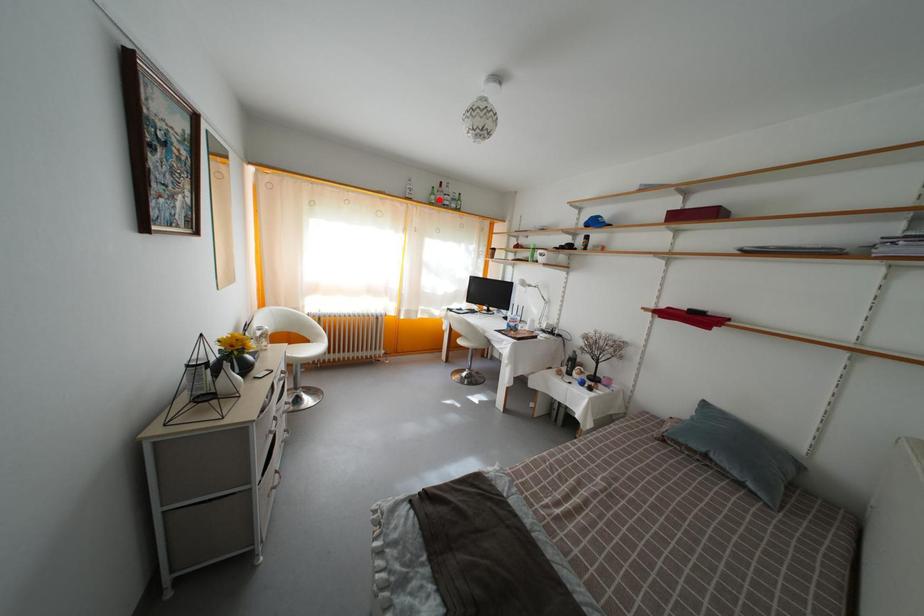
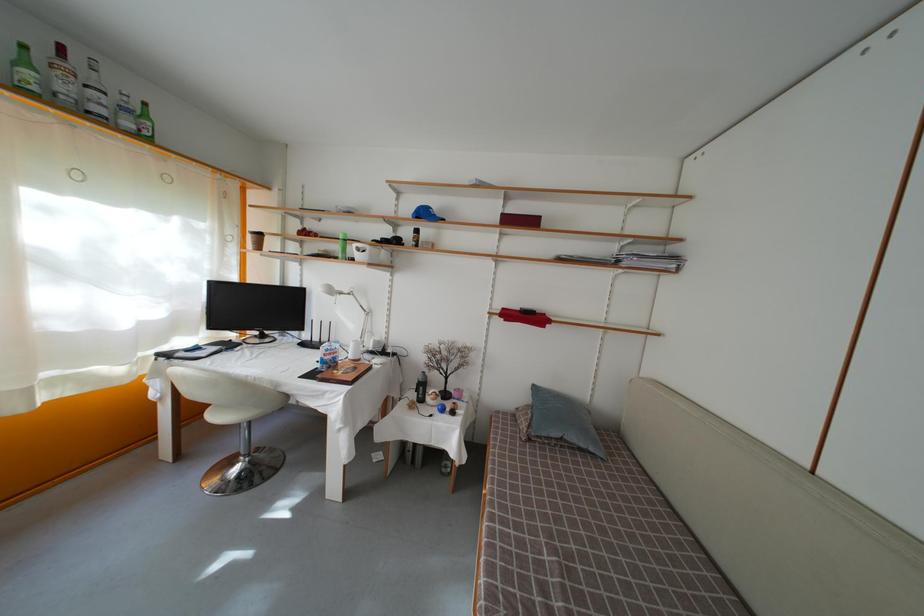
Find the pixel in the second image that matches the highlighted location in the first image.

(31, 69)